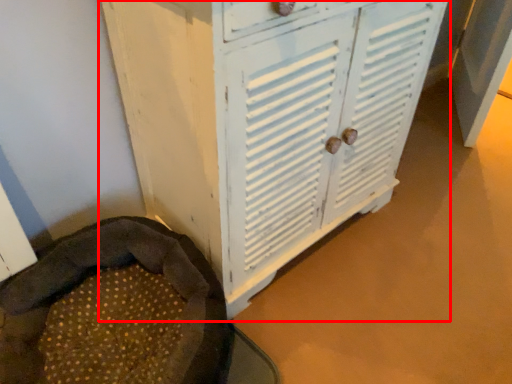
Question: Observing the image, what is the correct spatial positioning of cupboard (annotated by the red box) in reference to bean bag chair?

Choices:
 (A) right
 (B) left

Answer: (A)